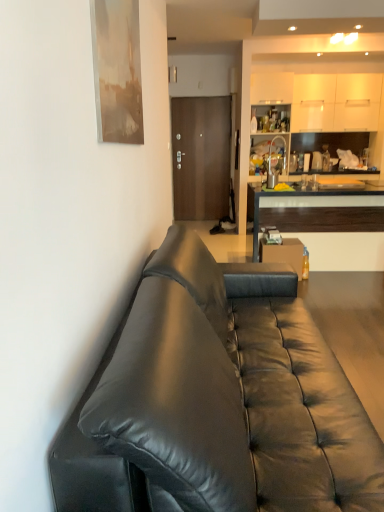
Question: Does black leather couch at left turn towards brown matte door at center?

Choices:
 (A) no
 (B) yes

Answer: (A)

Question: Considering the relative positions of black leather couch at left and brown matte door at center in the image provided, is black leather couch at left in front of brown matte door at center?

Choices:
 (A) no
 (B) yes

Answer: (B)

Question: Does black leather couch at left have a lesser height compared to brown matte door at center?

Choices:
 (A) no
 (B) yes

Answer: (B)

Question: Can you confirm if black leather couch at left is positioned to the left of brown matte door at center?

Choices:
 (A) no
 (B) yes

Answer: (A)

Question: Considering the relative sizes of black leather couch at left and brown matte door at center in the image provided, is black leather couch at left smaller than brown matte door at center?

Choices:
 (A) yes
 (B) no

Answer: (B)

Question: Is point (268, 195) closer or farther from the camera than point (218, 138)?

Choices:
 (A) farther
 (B) closer

Answer: (B)

Question: Considering the positions of wooden cabinet at right and brown matte door at center in the image, is wooden cabinet at right taller or shorter than brown matte door at center?

Choices:
 (A) short
 (B) tall

Answer: (A)

Question: Considering the positions of wooden cabinet at right and brown matte door at center in the image, is wooden cabinet at right wider or thinner than brown matte door at center?

Choices:
 (A) thin
 (B) wide

Answer: (B)

Question: Is wooden cabinet at right inside or outside of brown matte door at center?

Choices:
 (A) inside
 (B) outside

Answer: (B)

Question: Is brown matte door at center spatially inside wooden cabinet at right, or outside of it?

Choices:
 (A) inside
 (B) outside

Answer: (B)

Question: In terms of height, does brown matte door at center look taller or shorter compared to wooden cabinet at right?

Choices:
 (A) short
 (B) tall

Answer: (B)

Question: From a real-world perspective, is brown matte door at center positioned above or below wooden cabinet at right?

Choices:
 (A) below
 (B) above

Answer: (B)

Question: In terms of size, does brown matte door at center appear bigger or smaller than wooden cabinet at right?

Choices:
 (A) small
 (B) big

Answer: (A)

Question: From the image's perspective, is brown matte door at center positioned above or below black leather couch at left?

Choices:
 (A) above
 (B) below

Answer: (A)

Question: In terms of size, does brown matte door at center appear bigger or smaller than black leather couch at left?

Choices:
 (A) big
 (B) small

Answer: (B)